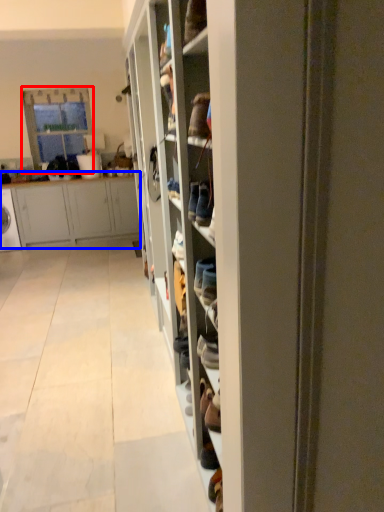
Question: Which object is closer to the camera taking this photo, glass door (highlighted by a red box) or cabinetry (highlighted by a blue box)?

Choices:
 (A) glass door
 (B) cabinetry

Answer: (B)